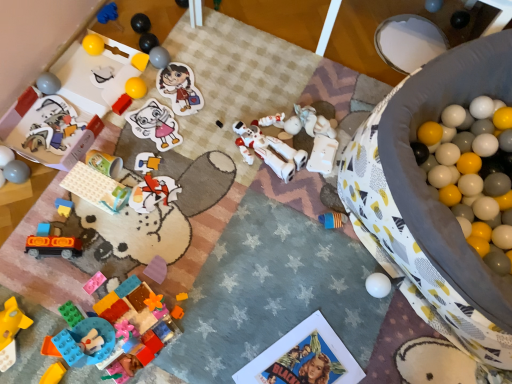
Question: Does blue fabric toy at upper left, which appears as the eighteenth toy when ordered from the bottom, appear on the left side of green matte cup at upper left, the 10th toy in the top-to-bottom sequence?

Choices:
 (A) no
 (B) yes

Answer: (B)

Question: Can you confirm if blue fabric toy at upper left, which appears as the eighteenth toy when ordered from the bottom, is thinner than green matte cup at upper left, the ninth toy positioned from the bottom?

Choices:
 (A) yes
 (B) no

Answer: (A)

Question: From a real-world perspective, is blue fabric toy at upper left, which appears as the 1th toy when viewed from the top, positioned over green matte cup at upper left, the 10th toy in the top-to-bottom sequence, based on gravity?

Choices:
 (A) yes
 (B) no

Answer: (B)

Question: Are blue fabric toy at upper left, which appears as the eighteenth toy when ordered from the bottom, and green matte cup at upper left, the ninth toy positioned from the bottom, beside each other?

Choices:
 (A) yes
 (B) no

Answer: (B)

Question: Is blue fabric toy at upper left, which appears as the 1th toy when viewed from the top, positioned behind green matte cup at upper left, the ninth toy positioned from the bottom?

Choices:
 (A) no
 (B) yes

Answer: (B)

Question: Is green matte cup at upper left, the 10th toy in the top-to-bottom sequence, completely or partially inside blue fabric toy at upper left, which appears as the 1th toy when viewed from the top?

Choices:
 (A) no
 (B) yes

Answer: (A)

Question: Can you confirm if yellow matte cube at upper left, the fifteenth toy positioned from the bottom, is wider than matte plastic toy at upper left, the sixth toy in the top-to-bottom sequence?

Choices:
 (A) no
 (B) yes

Answer: (B)

Question: Is yellow matte cube at upper left, the fifteenth toy positioned from the bottom, in contact with matte plastic toy at upper left, the 13th toy from the bottom?

Choices:
 (A) yes
 (B) no

Answer: (B)

Question: Could you tell me if yellow matte cube at upper left, placed as the 4th toy when sorted from top to bottom, is turned towards matte plastic toy at upper left, the sixth toy in the top-to-bottom sequence?

Choices:
 (A) no
 (B) yes

Answer: (A)

Question: Can you confirm if yellow matte cube at upper left, the fifteenth toy positioned from the bottom, is smaller than matte plastic toy at upper left, the sixth toy in the top-to-bottom sequence?

Choices:
 (A) no
 (B) yes

Answer: (B)

Question: Is yellow matte cube at upper left, the fifteenth toy positioned from the bottom, thinner than matte plastic toy at upper left, the 13th toy from the bottom?

Choices:
 (A) yes
 (B) no

Answer: (B)

Question: Is yellow matte cube at upper left, placed as the 4th toy when sorted from top to bottom, outside of matte plastic toy at upper left, the sixth toy in the top-to-bottom sequence?

Choices:
 (A) yes
 (B) no

Answer: (A)

Question: From a real-world perspective, is matte plastic toy car at lower left, the eighth toy in the bottom-to-top sequence, positioned over shiny metallic ball at upper center, arranged as the sixteenth toy when ordered from the bottom, based on gravity?

Choices:
 (A) no
 (B) yes

Answer: (A)